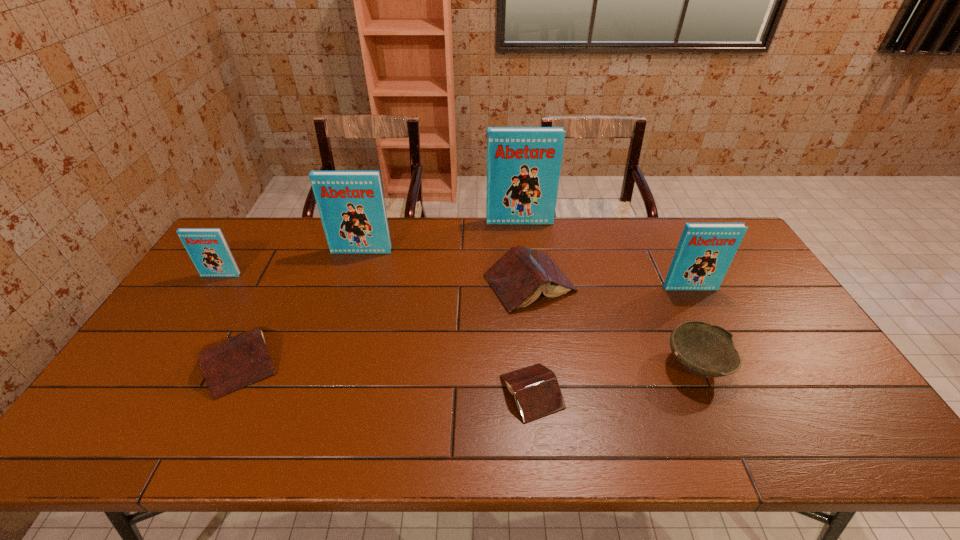
Where is `the farthest book`? Image resolution: width=960 pixels, height=540 pixels. the farthest book is located at coordinates click(x=523, y=163).

This screenshot has height=540, width=960. What are the coordinates of `the farthest blue book` in the screenshot? It's located at (523, 163).

The image size is (960, 540). Find the location of `the second tallest book`. the second tallest book is located at coordinates (351, 205).

Identify the location of the fifth book from right to left. Image resolution: width=960 pixels, height=540 pixels. (351, 205).

Identify the location of the third tallest object. (705, 251).

This screenshot has height=540, width=960. I want to click on the second smallest blue book, so click(x=705, y=251).

The width and height of the screenshot is (960, 540). Identify the location of the leftmost object. (207, 247).

I want to click on the fourth shortest book, so click(x=207, y=247).

Locate an element on the screen. Image resolution: width=960 pixels, height=540 pixels. the fifth tallest book is located at coordinates (518, 278).

You are a GUI agent. You are given a task and a screenshot of the screen. Output one action in this format:
    pyautogui.click(x=<x>, y=<y>)
    Task: Click on the farthest brown book
    
    Given the screenshot: What is the action you would take?
    pyautogui.click(x=518, y=278)